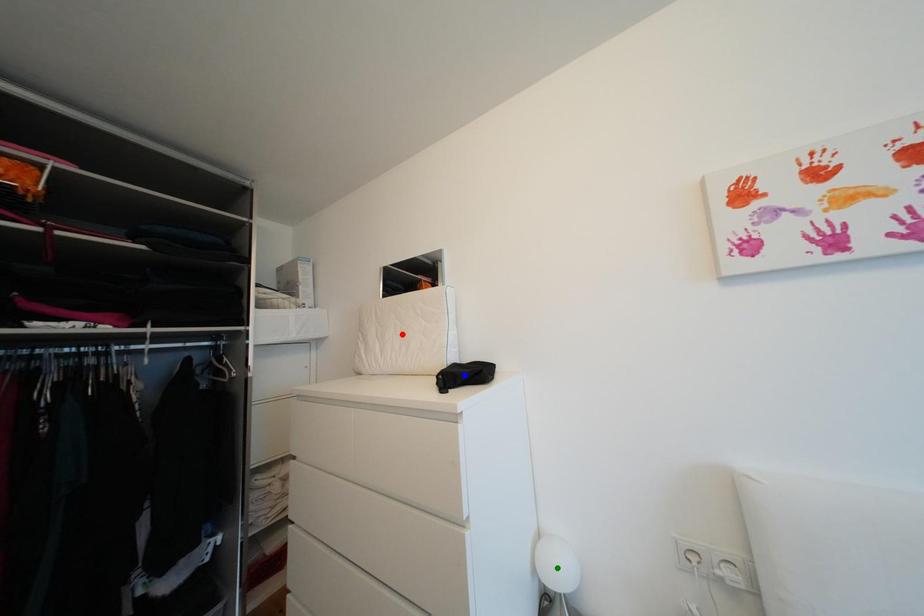
Consider the image. Order these from nearest to farthest:
blue point | green point | red point

red point
blue point
green point